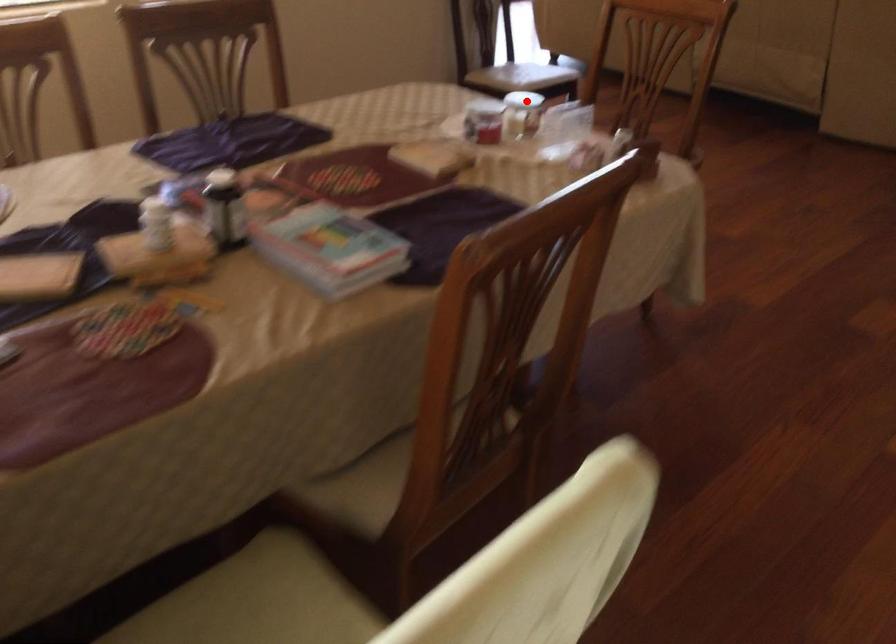
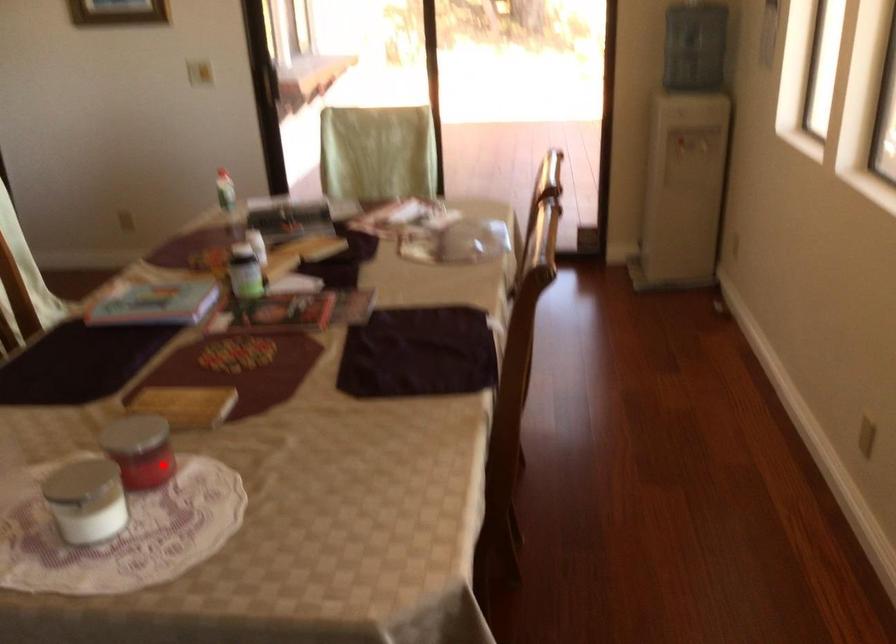
I am providing you with two images of the same scene from different viewpoints. A red point is marked on the first image and another point is marked on the second image. Are the points marked in image1 and image2 representing the same 3D position?

No